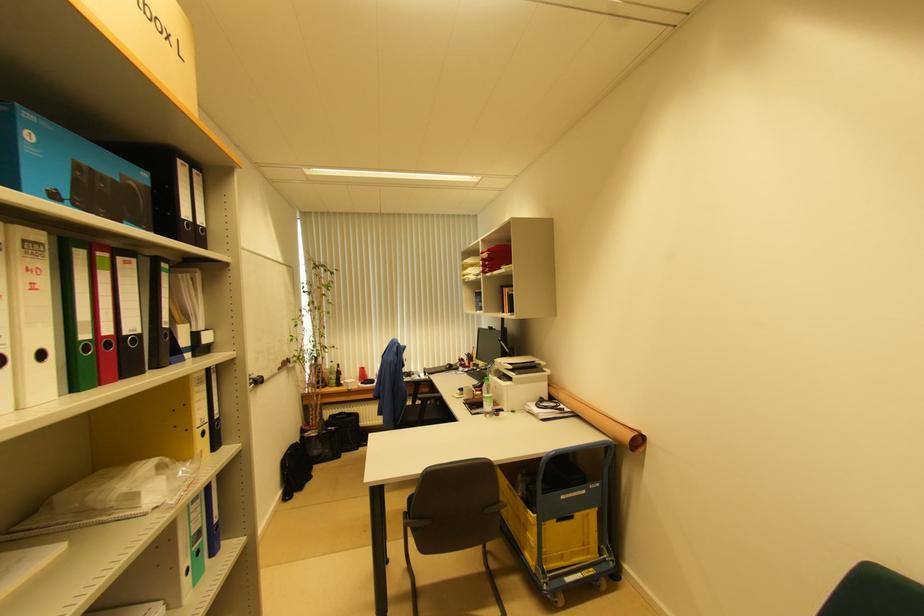
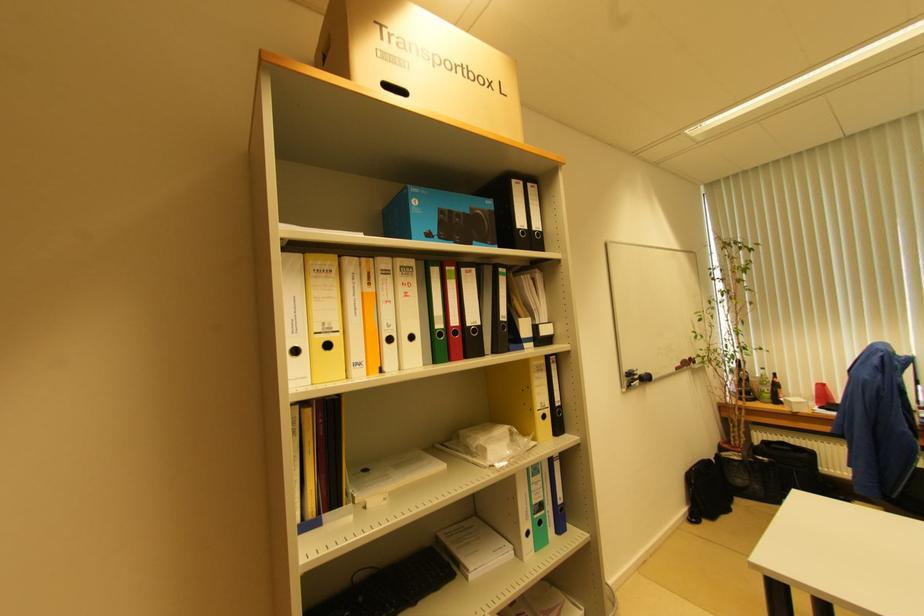
Question: Based on the continuous images, in which direction is the camera rotating? Reply with the corresponding letter.

Choices:
 (A) Left
 (B) Right
 (C) Up
 (D) Down

Answer: (A)